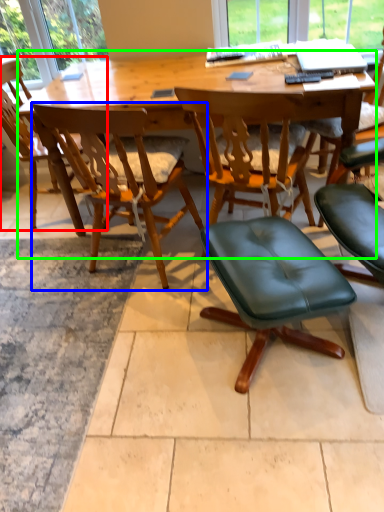
Question: Estimate the real-world distances between objects in this image. Which object is closer to chair (highlighted by a red box), chair (highlighted by a blue box) or desk (highlighted by a green box)?

Choices:
 (A) chair
 (B) desk

Answer: (B)